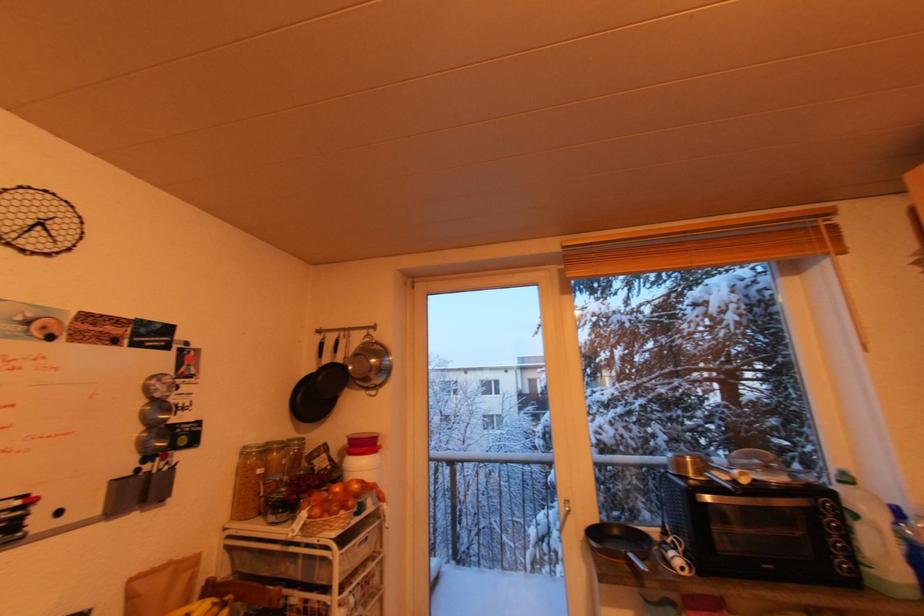
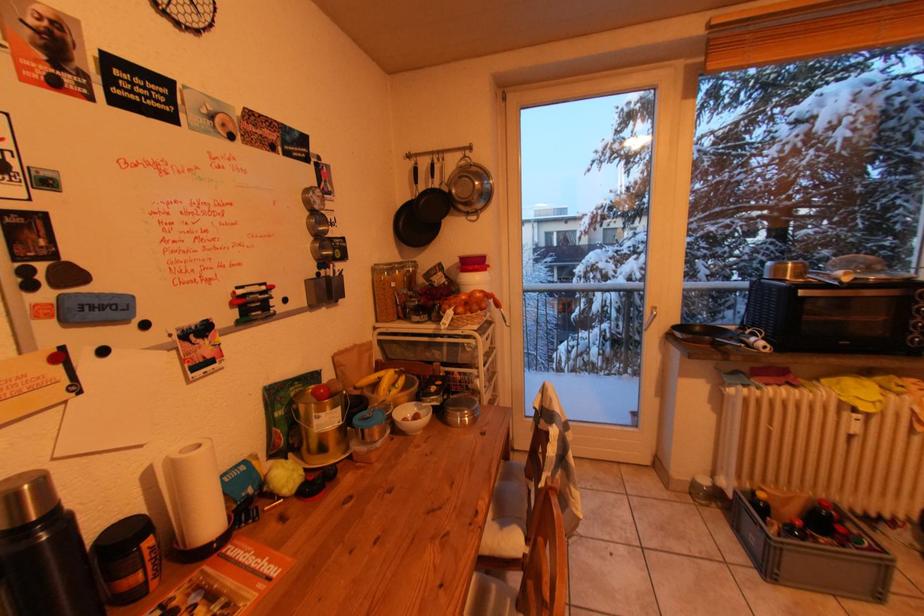
Question: Based on the continuous images, in which direction is the camera rotating? Reply with the corresponding letter.

Choices:
 (A) Left
 (B) Right
 (C) Up
 (D) Down

Answer: (D)